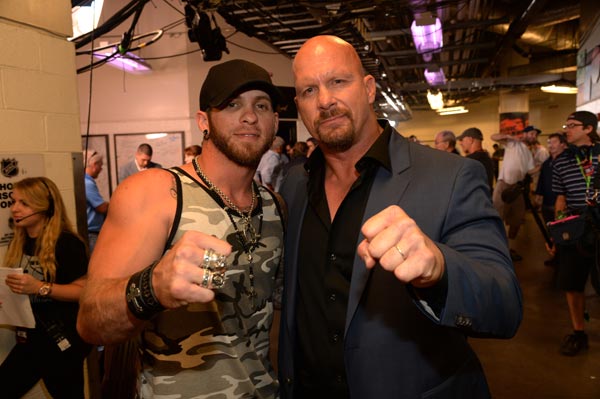
In order to click on support pillar in this screenshot , I will do `click(514, 104)`.